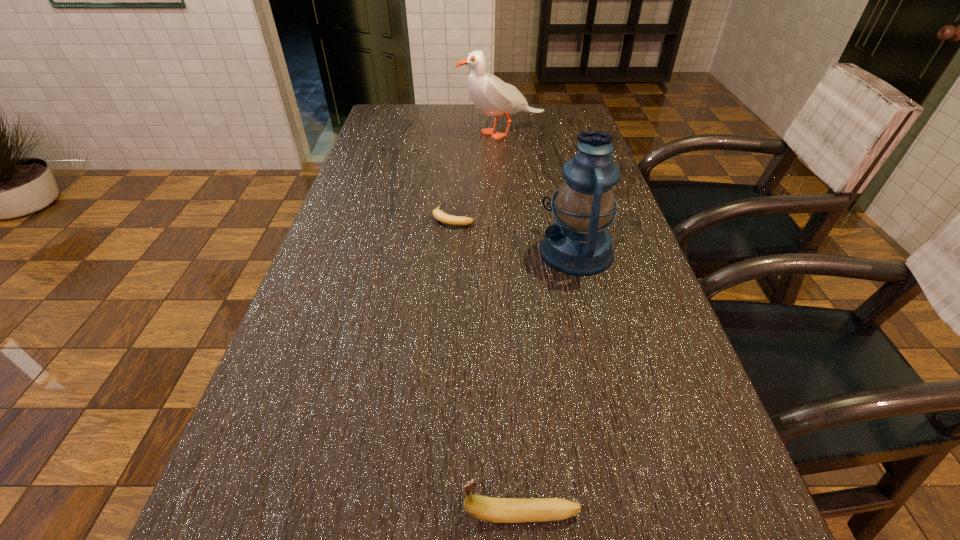
Where is `free point at the far edge`? This screenshot has width=960, height=540. free point at the far edge is located at coordinates click(x=430, y=105).

The height and width of the screenshot is (540, 960). What are the coordinates of `free location at the left edge of the desktop` in the screenshot? It's located at (262, 529).

This screenshot has height=540, width=960. In the image, there is a desktop. Find the location of `vacant space at the right edge`. vacant space at the right edge is located at coordinates (684, 417).

The image size is (960, 540). Find the location of `vacant region at the far left corner`. vacant region at the far left corner is located at coordinates (394, 109).

Find the location of a particular element. free space at the far right corner of the desktop is located at coordinates (545, 128).

The image size is (960, 540). What are the coordinates of `free space between the lantern and the gull` in the screenshot? It's located at (540, 192).

At what (x,y) coordinates should I click in order to perform the action: click on free space between the shorter banana and the lantern. Please return your answer as a coordinate pair (x, y). Looking at the image, I should click on (515, 234).

This screenshot has height=540, width=960. In order to click on free space between the gull and the lantern in this screenshot , I will do `click(540, 192)`.

The image size is (960, 540). In order to click on free space between the nearer banana and the shortest object in this screenshot , I will do `click(488, 366)`.

Find the location of a particular element. free space between the lantern and the gull is located at coordinates (540, 192).